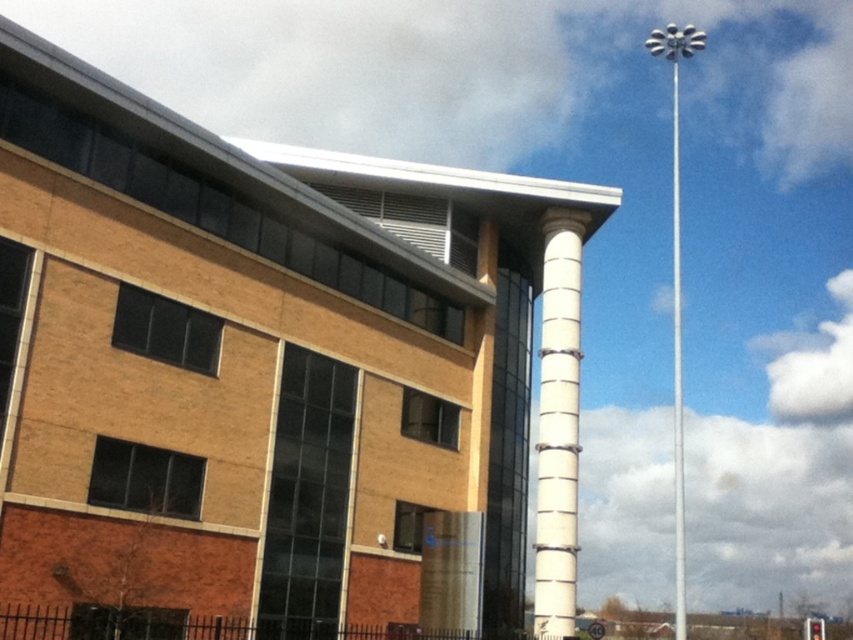
Is white glossy column at center thinner than white metallic pole at right?

Yes.

Does white glossy column at center appear under white metallic pole at right?

Correct, white glossy column at center is located below white metallic pole at right.

Is point (561, 227) closer to camera compared to point (675, 308)?

Yes, it is.

Find the location of a particular element. Image resolution: width=853 pixels, height=640 pixels. white glossy column at center is located at coordinates (558, 422).